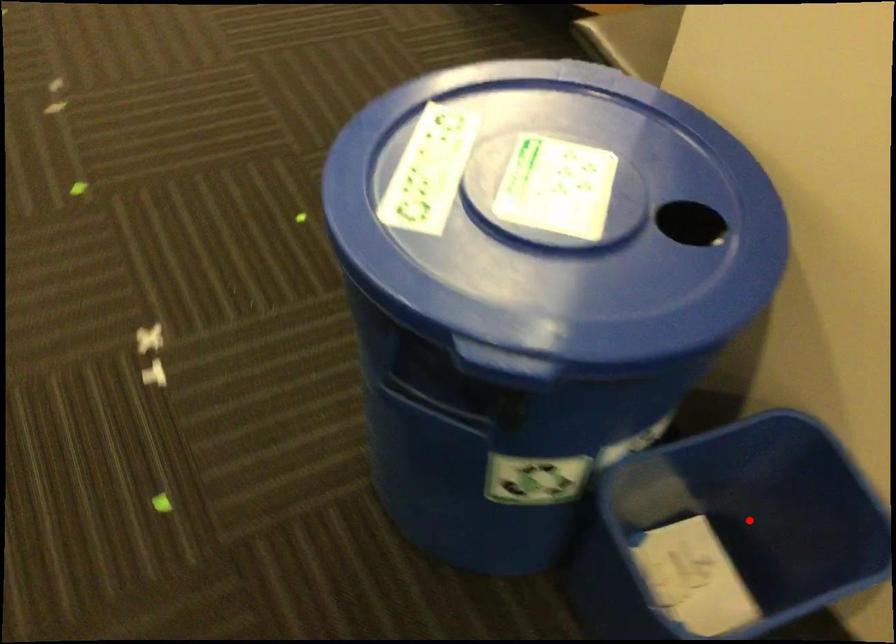
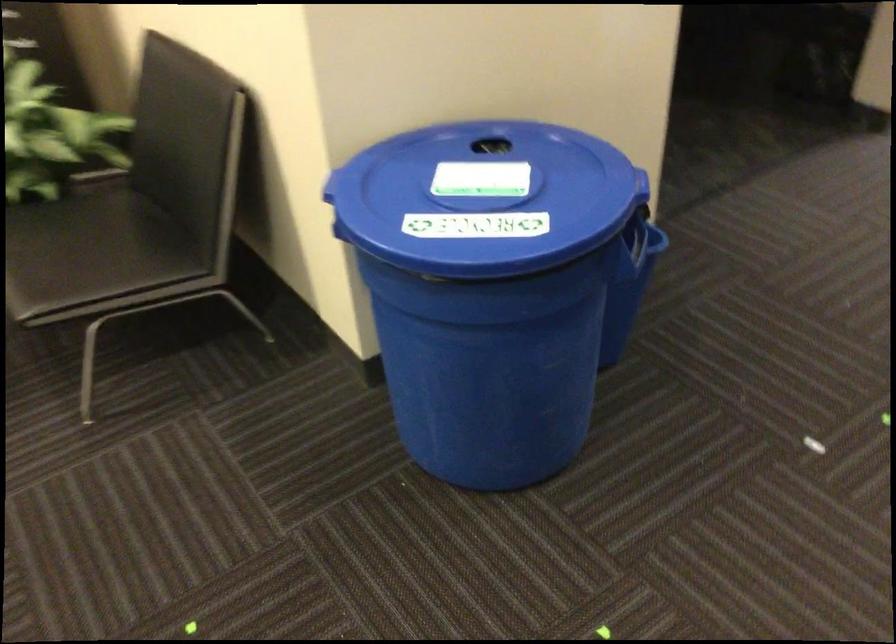
Question: I am providing you with two images of the same scene from different viewpoints. A red point is marked on the first image. At the location where the point appears in image 1, is it still visible in image 2?

Choices:
 (A) Yes
 (B) No

Answer: (B)